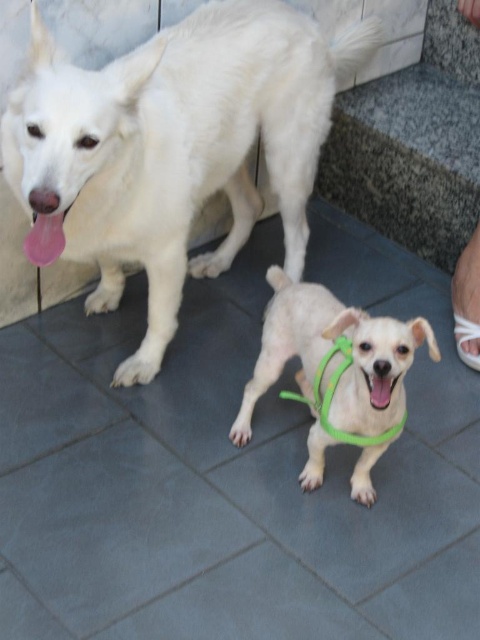
Which of these two, light brown fur at center or black matte mouth at center, stands shorter?

black matte mouth at center is shorter.

Is light brown fur at center in front of black matte mouth at center?

Yes, light brown fur at center is closer to the viewer.

Between point (324, 348) and point (372, 380), which one is positioned in front?

Positioned in front is point (372, 380).

Where is `light brown fur at center`? This screenshot has height=640, width=480. light brown fur at center is located at coordinates (325, 353).

Is green nylon leash at center below black matte mouth at center?

Yes.

Is point (328, 392) in front of point (381, 380)?

No, it is behind (381, 380).

Find the location of a particular element. green nylon leash at center is located at coordinates (333, 396).

Does white fur dog at upper left appear on the left side of green nylon leash at center?

Yes, white fur dog at upper left is to the left of green nylon leash at center.

Is the position of white fur dog at upper left less distant than that of green nylon leash at center?

Yes, it is in front of green nylon leash at center.

Which is in front, point (295, 188) or point (288, 397)?

Positioned in front is point (288, 397).

Image resolution: width=480 pixels, height=640 pixels. I want to click on white fur dog at upper left, so click(x=172, y=147).